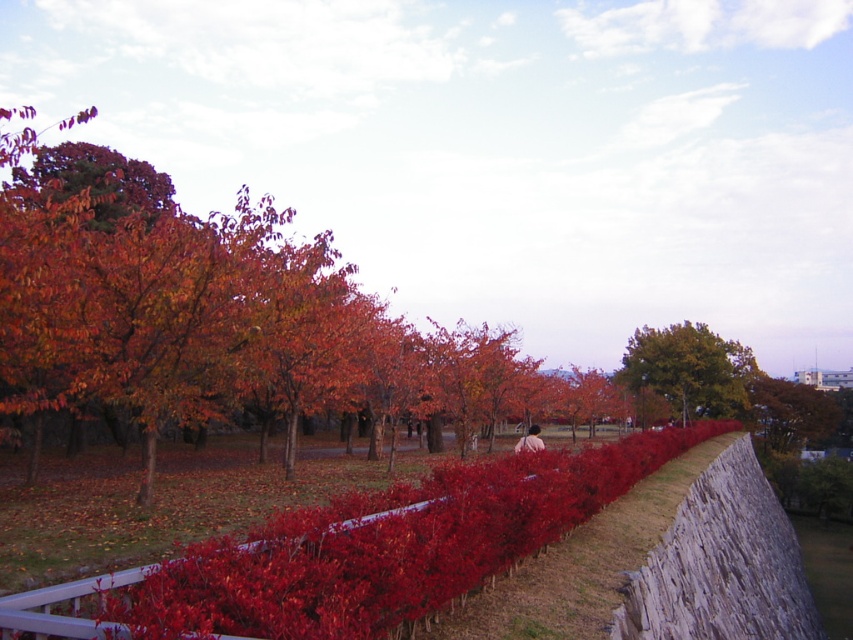
Between bright red hedge at center and green leafy tree at upper right, which one has less height?

With less height is bright red hedge at center.

Which is above, bright red hedge at center or green leafy tree at upper right?

bright red hedge at center is above.

Does point (285, 609) come farther from viewer compared to point (676, 358)?

No, it is not.

This screenshot has width=853, height=640. I want to click on bright red hedge at center, so click(389, 547).